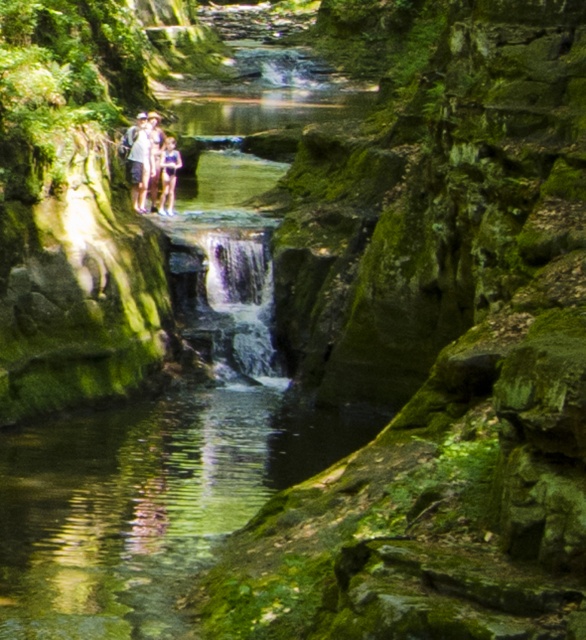
Question: Is light brown wooden couple at center bigger than blue denim shorts at center?

Choices:
 (A) no
 (B) yes

Answer: (B)

Question: Among these objects, which one is farthest from the camera?

Choices:
 (A) blue denim shorts at center
 (B) light brown wooden couple at center

Answer: (A)

Question: Among these objects, which one is farthest from the camera?

Choices:
 (A) blue denim shorts at center
 (B) light brown wooden couple at center

Answer: (A)

Question: Is light brown wooden couple at center bigger than blue denim shorts at center?

Choices:
 (A) no
 (B) yes

Answer: (B)

Question: From the image, what is the correct spatial relationship of light brown wooden couple at center in relation to blue denim shorts at center?

Choices:
 (A) right
 (B) left

Answer: (B)